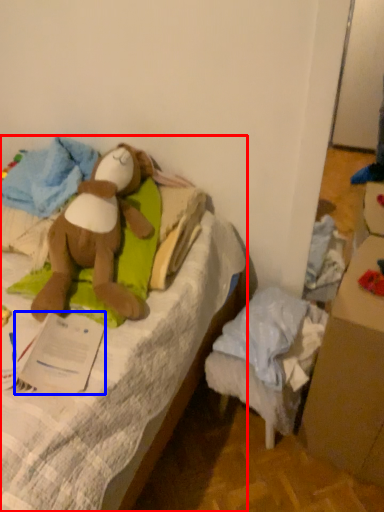
Question: Among these objects, which one is nearest to the camera, furniture (highlighted by a red box) or paper (highlighted by a blue box)?

Choices:
 (A) furniture
 (B) paper

Answer: (A)